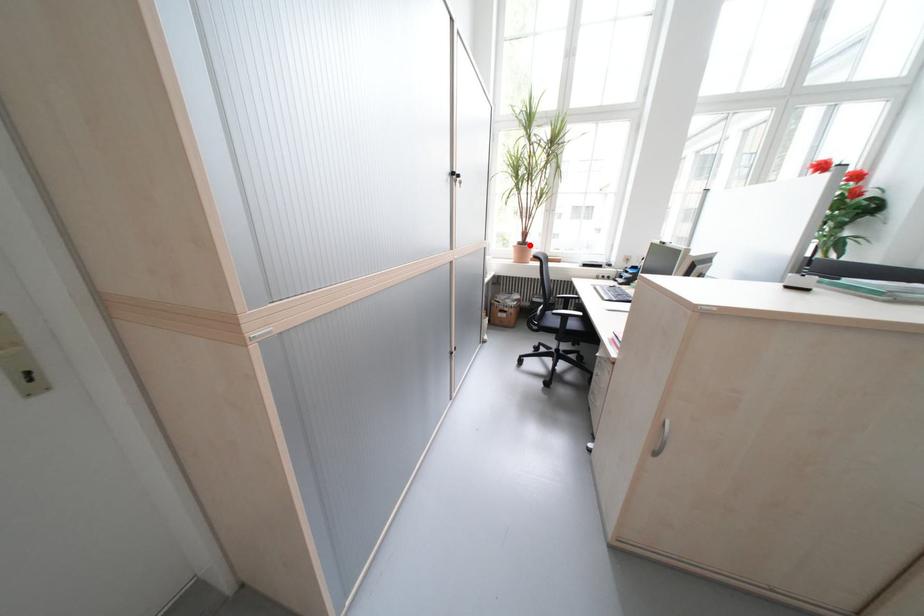
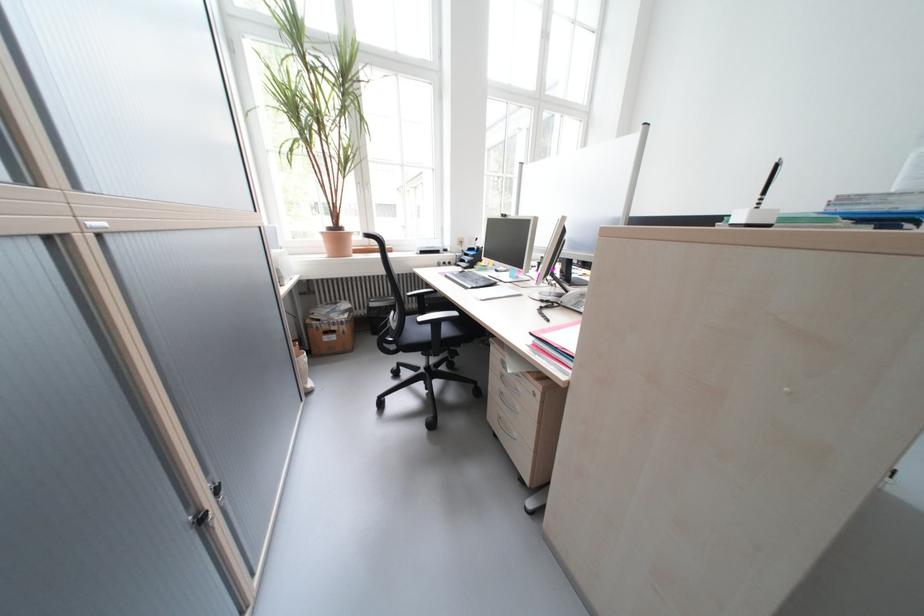
Where in the second image is the point corresponding to the highlighted location from the first image?

(339, 231)